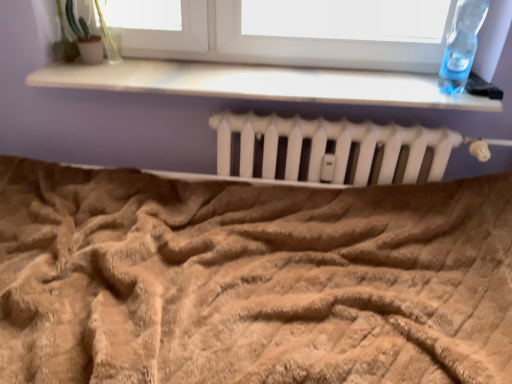
Question: From a real-world perspective, is transparent plastic bottle at upper right positioned above or below beige textured blanket at center?

Choices:
 (A) above
 (B) below

Answer: (A)

Question: Considering the positions of transparent plastic bottle at upper right and beige textured blanket at center in the image, is transparent plastic bottle at upper right wider or thinner than beige textured blanket at center?

Choices:
 (A) wide
 (B) thin

Answer: (B)

Question: Which object is the farthest from the beige textured blanket at center?

Choices:
 (A) white matte radiator at center
 (B) transparent plastic bottle at upper right
 (C) green matte plant at upper left

Answer: (C)

Question: Considering the real-world distances, which object is farthest from the white matte radiator at center?

Choices:
 (A) beige textured blanket at center
 (B) transparent plastic bottle at upper right
 (C) green matte plant at upper left

Answer: (C)